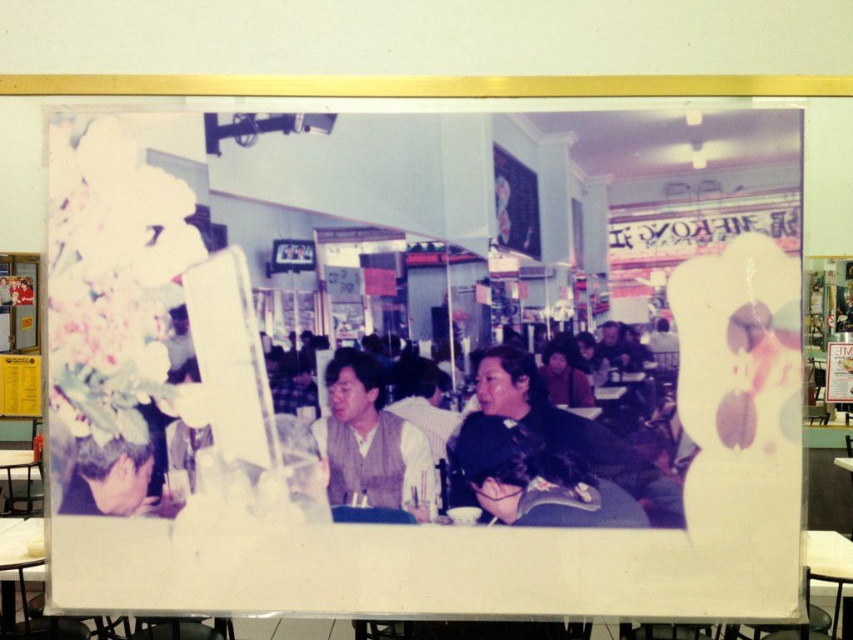
In the scene shown: You are a photographer trying to capture a candid shot of the light brown vest at center and the blonde hair at lower left. Since you want both subjects to be in focus, which one should you adjust your camera focus to prioritize first?

The light brown vest at center has a greater height compared to blonde hair at lower left, so you should prioritize focusing on the light brown vest at center first to ensure both are in focus.

You are a photographer trying to capture a candid shot of the dark brown hair at center in the image. The camera you are using has a focal length of 50mm and an aperture of f2.8. To ensure the subject is in focus, you need to calculate the hyperfocal distance. What is the hyperfocal distance required for this shot?

The hyperfocal distance can be calculated using the formula H_focal_length squared divided by the product of the circle of confusion and the aperture value. However, without knowing the sensor size and the circle of confusion value for the camera, an exact calculation cannot be provided. Therefore, the hyperfocal distance cannot be determined with the given information.